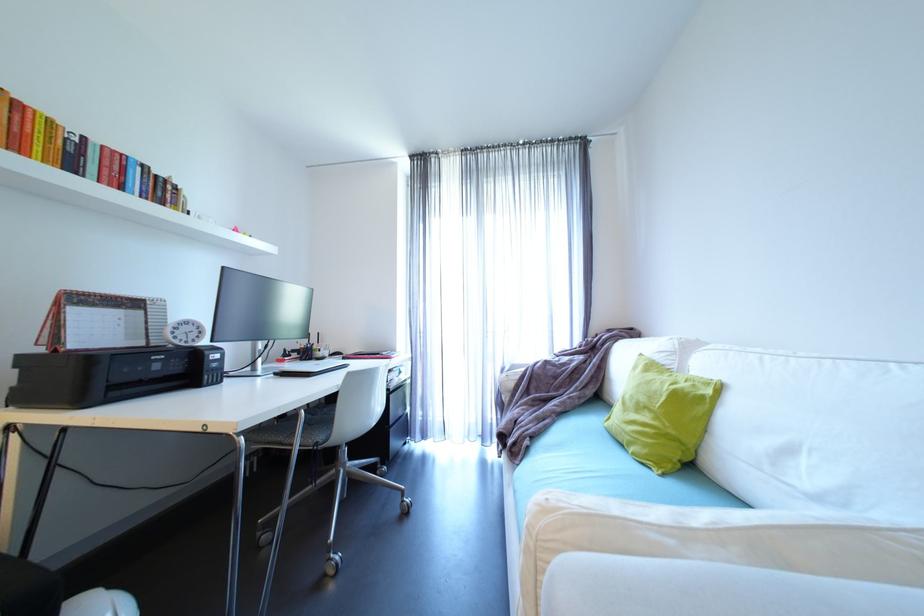
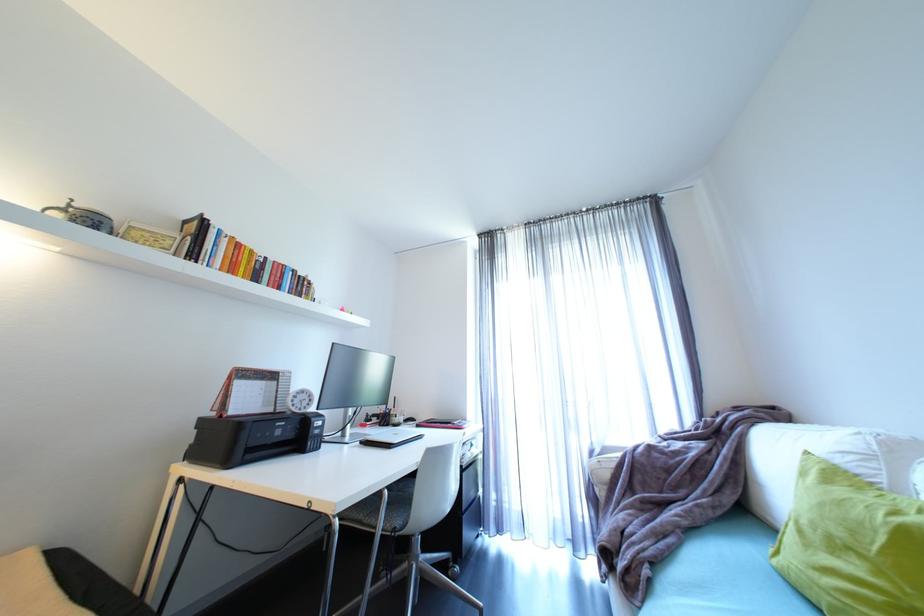
Find the pixel in the second image that matches (533,442) in the first image.

(653, 572)